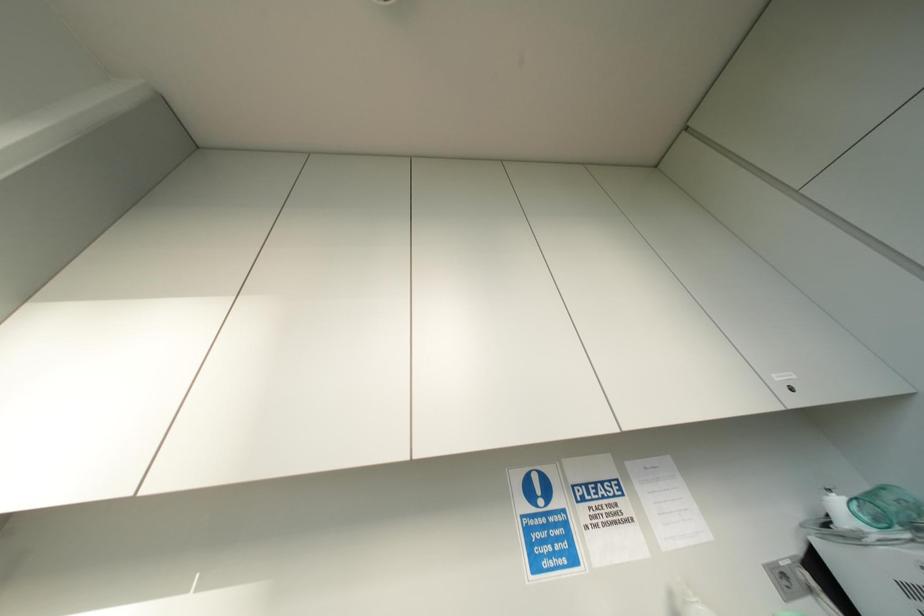
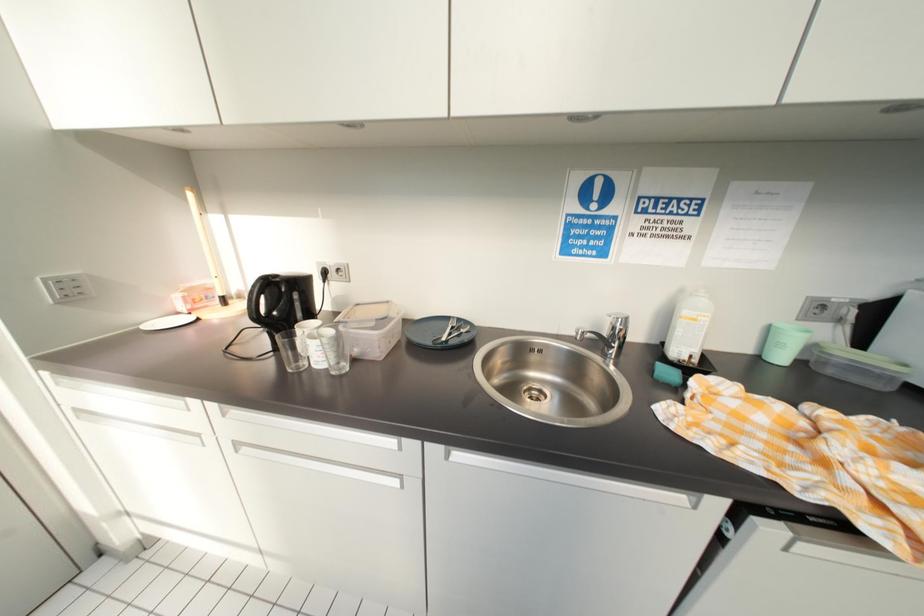
How did the camera likely rotate?

The camera rotated toward left-down.